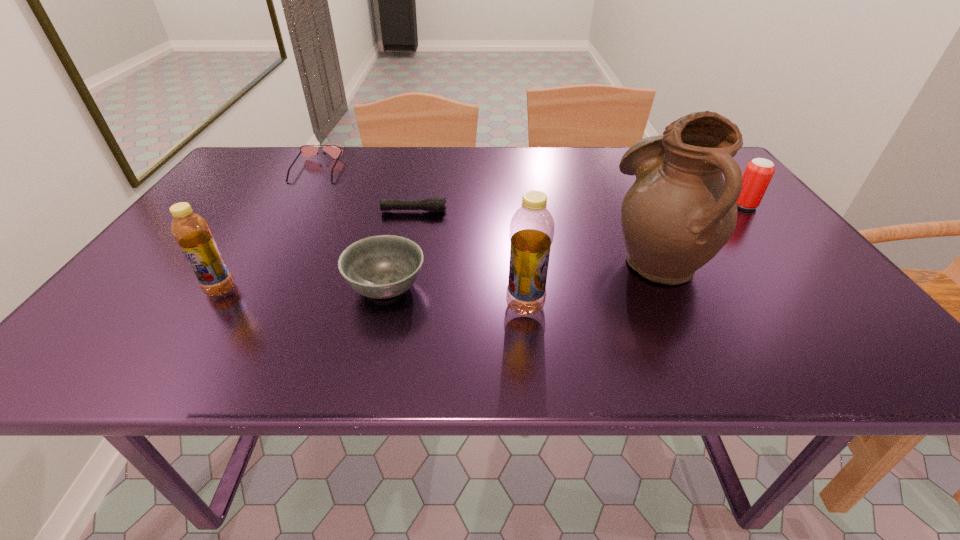
Please show where to add a bottle on the right while keeping spacing even. Please provide its 2D coordinates. Your answer should be formatted as a tuple, i.e. [(x, y)], where the tuple contains the x and y coordinates of a point satisfying the conditions above.

[(855, 323)]